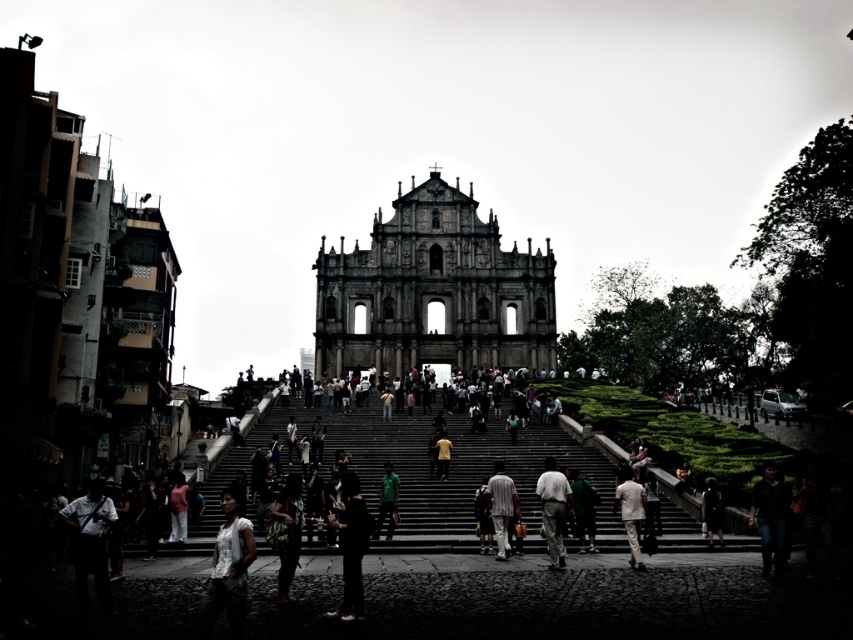
You are a photographer positioned at the base of the staircase in front of the historic building. You want to capture a photo that includes both the dark gray fabric shirt at lower left and the black fabric pants at center. Based on their positions, which direction should you move to ensure both are in frame?

You should move to the right to include both the dark gray fabric shirt at lower left and the black fabric pants at center in your photo since the dark gray fabric shirt at lower left is to the left of the black fabric pants at center.

You are a photographer standing at the base of the staircase in front of the historic building. You notice two items in your viewfinder, the dark brown leather jacket at lower right and the light beige fabric pants at center. Which item appears larger in your photo?

The dark brown leather jacket at lower right appears larger in the photo because it is bigger than the light beige fabric pants at center.

You are standing at the bottom of the staircase in front of the historic building. You see a dark brown leather jacket at lower right. Where exactly is the dark brown leather jacket located in relation to the staircase?

The dark brown leather jacket at lower right is located at the bottom of the staircase, near the lower right corner, as its 2D coordinates are at point (770, 516).